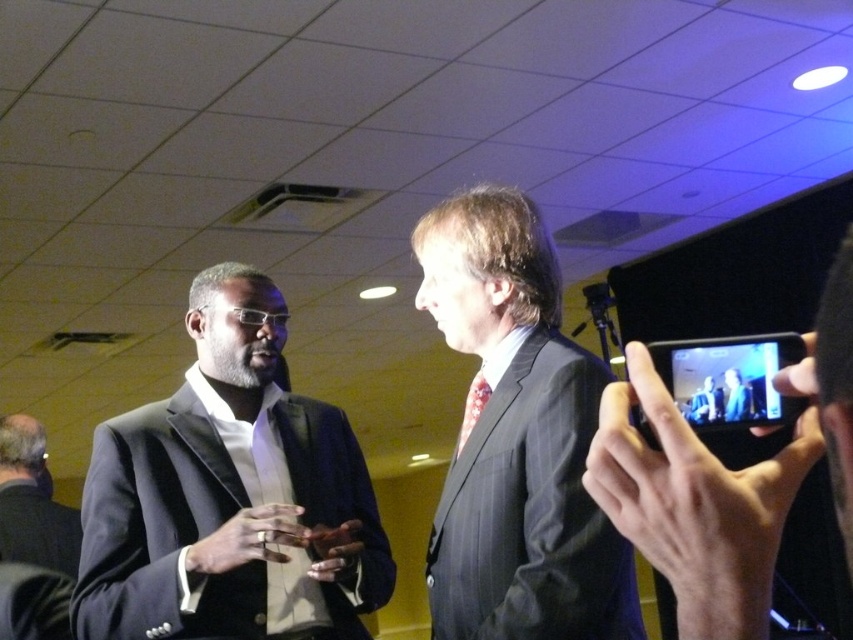
Question: Where is dark gray pinstripe suit at center located in relation to dark gray suit at lower left in the image?

Choices:
 (A) below
 (B) above

Answer: (B)

Question: Does matte black suit at left have a larger size compared to patterned silk tie at center?

Choices:
 (A) no
 (B) yes

Answer: (B)

Question: Which object is closer to the camera taking this photo?

Choices:
 (A) dark gray suit at lower left
 (B) dark gray pinstripe suit at center
 (C) patterned silk tie at center
 (D) matte black suit at left

Answer: (B)

Question: Based on their relative distances, which object is farther from the dark gray pinstripe suit at center?

Choices:
 (A) matte black suit at center
 (B) matte black suit at left
 (C) patterned silk tie at center

Answer: (A)

Question: Which object is closer to the camera taking this photo?

Choices:
 (A) dark gray suit at lower left
 (B) matte black suit at left

Answer: (B)

Question: Does dark gray pinstripe suit at center have a larger size compared to patterned silk tie at center?

Choices:
 (A) no
 (B) yes

Answer: (B)